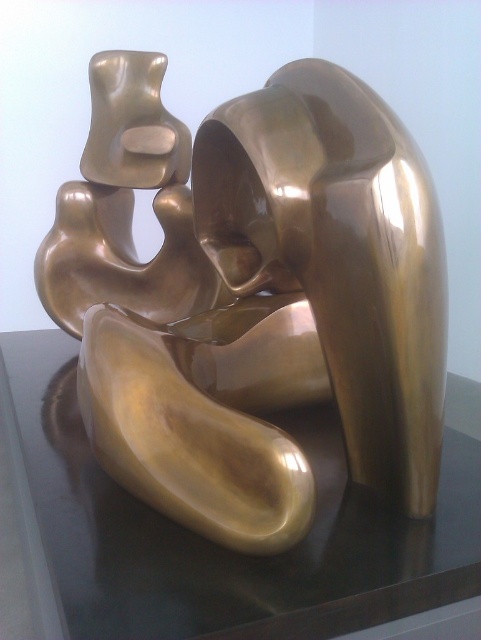
Between gold polished sculpture at center and transparent glass table at center, which one has more height?

gold polished sculpture at center

Is the position of gold polished sculpture at center more distant than that of transparent glass table at center?

Yes.

In order to click on gold polished sculpture at center in this screenshot , I will do `click(252, 296)`.